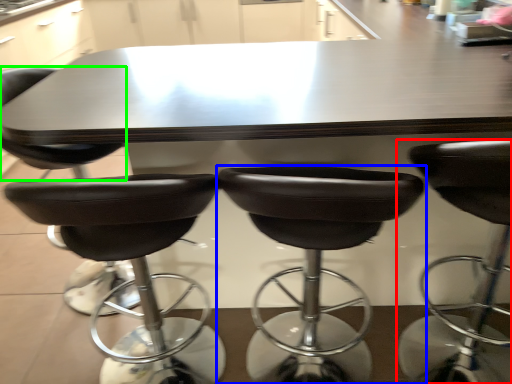
Question: Which is farther away from chair (highlighted by a red box)? chair (highlighted by a blue box) or chair (highlighted by a green box)?

Choices:
 (A) chair
 (B) chair

Answer: (B)